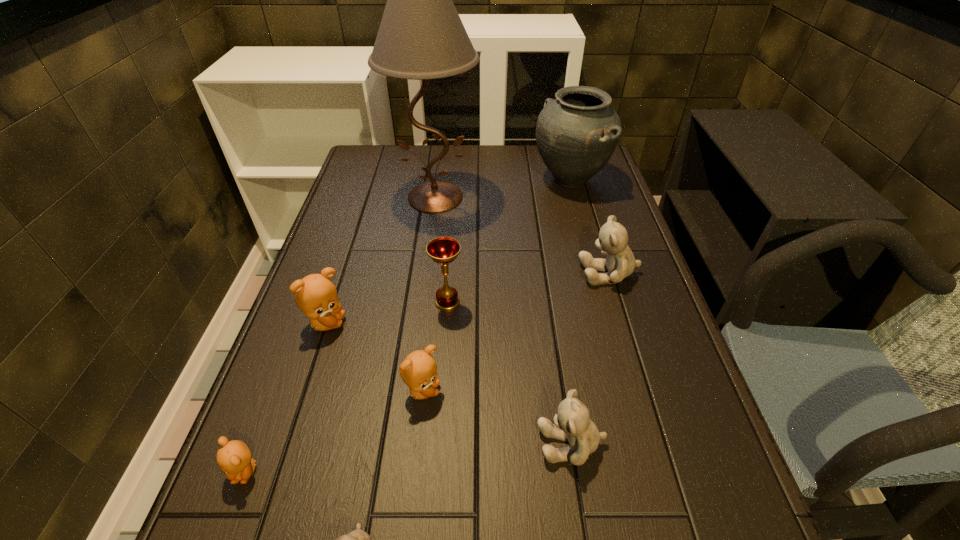
The width and height of the screenshot is (960, 540). I want to click on free space located 0.130m on the face of the second farthest brown teddy bear, so (x=506, y=391).

What are the coordinates of `vacant area situated on the face of the second smallest gray teddy bear` in the screenshot? It's located at (498, 443).

I want to click on free space located on the face of the second smallest gray teddy bear, so click(x=409, y=443).

You are a GUI agent. You are given a task and a screenshot of the screen. Output one action in this format:
    pyautogui.click(x=<x>, y=<y>)
    Task: Click on the vacant space located on the face of the second smallest gray teddy bear
    This screenshot has width=960, height=540.
    Given the screenshot: What is the action you would take?
    pyautogui.click(x=358, y=443)

Image resolution: width=960 pixels, height=540 pixels. In order to click on vacant space located on the face of the smallest brown teddy bear in this screenshot , I will do `click(228, 519)`.

I want to click on table lamp that is at the far edge, so click(x=421, y=36).

Identify the location of urn that is at the far edge. (576, 134).

You are a GUI agent. You are given a task and a screenshot of the screen. Output one action in this format:
    pyautogui.click(x=<x>, y=<y>)
    Task: Click on the table lamp situated at the left edge
    
    Given the screenshot: What is the action you would take?
    pyautogui.click(x=421, y=36)

Locate an element on the screen. The height and width of the screenshot is (540, 960). urn situated at the right edge is located at coordinates (576, 134).

At what (x,y) coordinates should I click in order to perform the action: click on teddy bear positioned at the right edge. Please return your answer as a coordinate pair (x, y). Looking at the image, I should click on (620, 262).